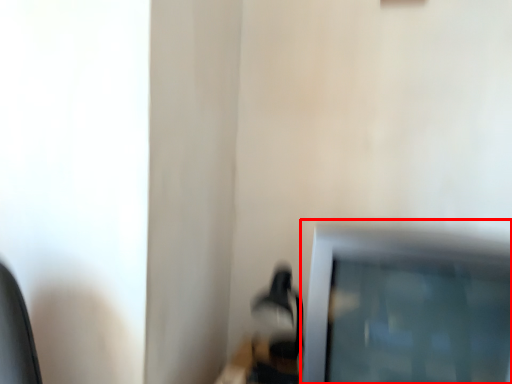
Question: Where is television (annotated by the red box) located in relation to table lamp in the image?

Choices:
 (A) left
 (B) right

Answer: (B)